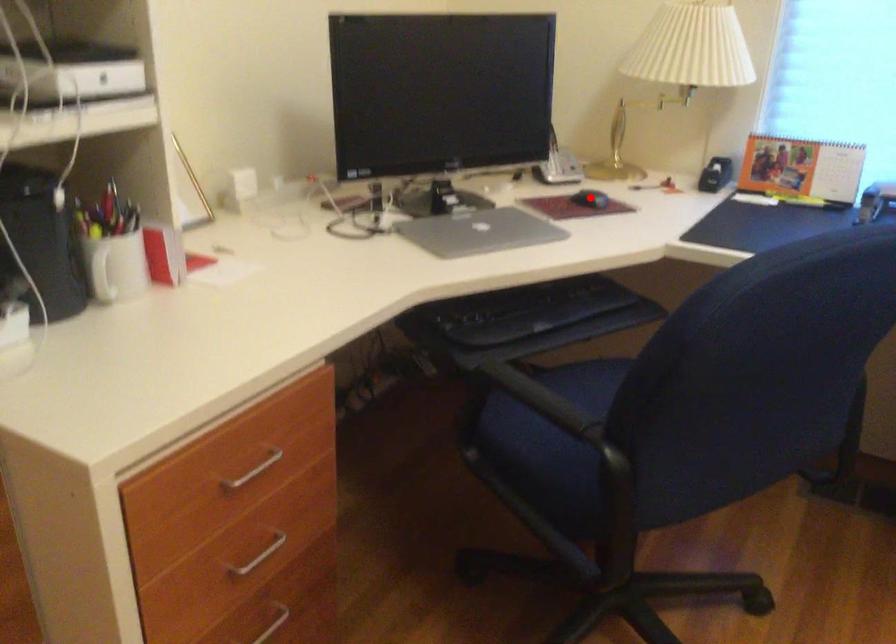
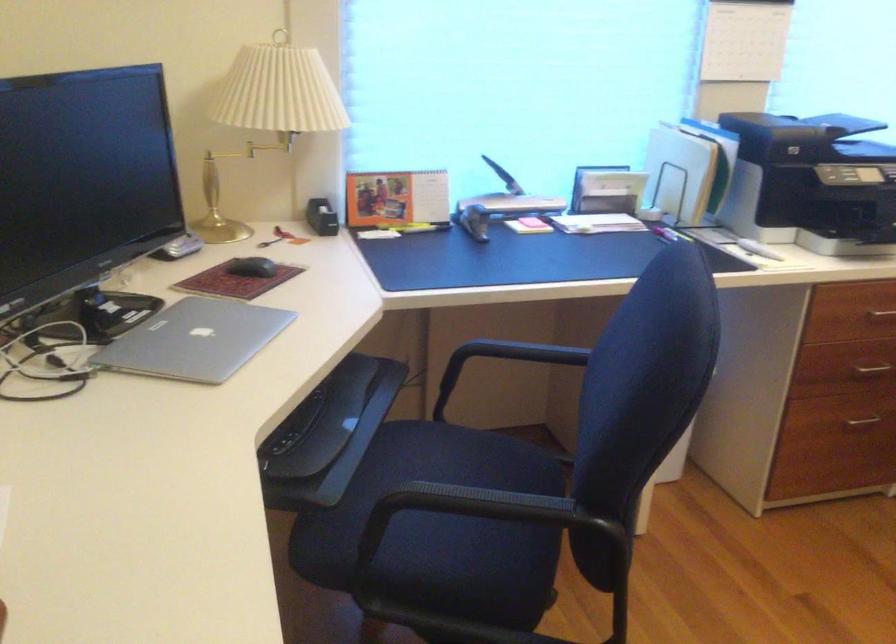
Question: I am providing you with two images of the same scene from different viewpoints. In image1, a red point is highlighted. Considering the same 3D point in image2, which of the following is correct?

Choices:
 (A) It is closer
 (B) It is farther

Answer: (A)